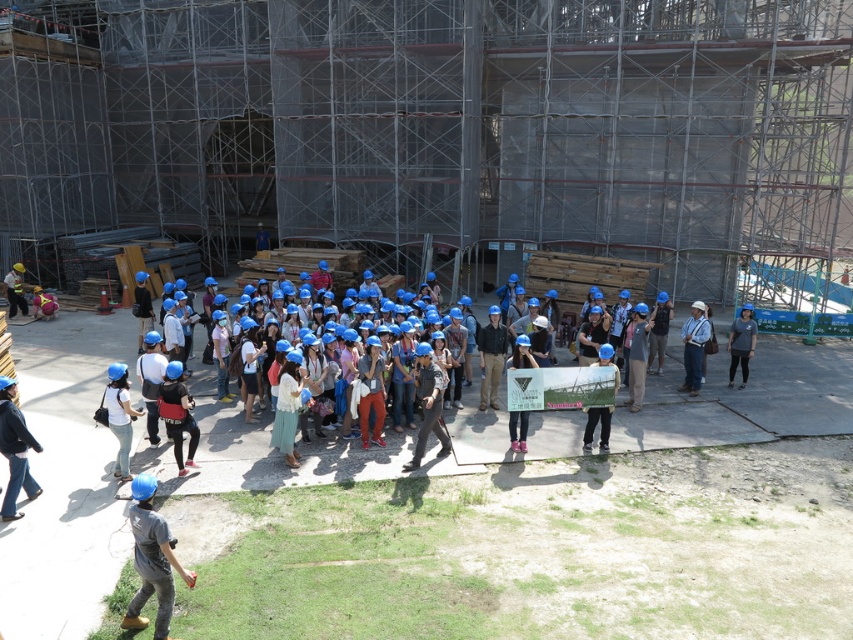
Can you confirm if matte blue helmet at lower center is positioned to the right of white matte shirt at center?

Correct, you'll find matte blue helmet at lower center to the right of white matte shirt at center.

Between matte blue helmet at lower center and white matte shirt at center, which one has less height?

matte blue helmet at lower center

Is point (164, 579) more distant than point (131, 410)?

No, it is in front of (131, 410).

The image size is (853, 640). Identify the location of matte blue helmet at lower center. (151, 560).

Can you confirm if blue hard hats at center is positioned to the right of matte blue helmet at center?

Correct, you'll find blue hard hats at center to the right of matte blue helmet at center.

Does blue hard hats at center appear under matte blue helmet at center?

Correct, blue hard hats at center is located below matte blue helmet at center.

What do you see at coordinates (572, 515) in the screenshot? The image size is (853, 640). I see `blue hard hats at center` at bounding box center [572, 515].

Locate an element on the screen. The image size is (853, 640). blue hard hats at center is located at coordinates (572, 515).

Can you confirm if matte blue helmet at lower center is positioned to the left of matte blue helmet at center?

In fact, matte blue helmet at lower center is to the right of matte blue helmet at center.

Between point (154, 550) and point (193, 428), which one is positioned behind?

The point (193, 428) is behind.

Where is `matte blue helmet at lower center`? Image resolution: width=853 pixels, height=640 pixels. matte blue helmet at lower center is located at coordinates (151, 560).